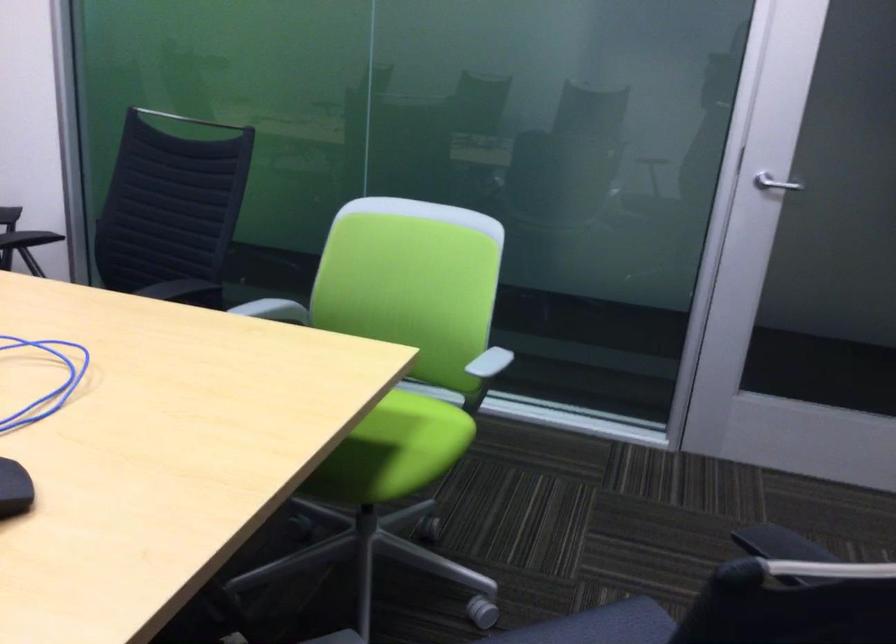
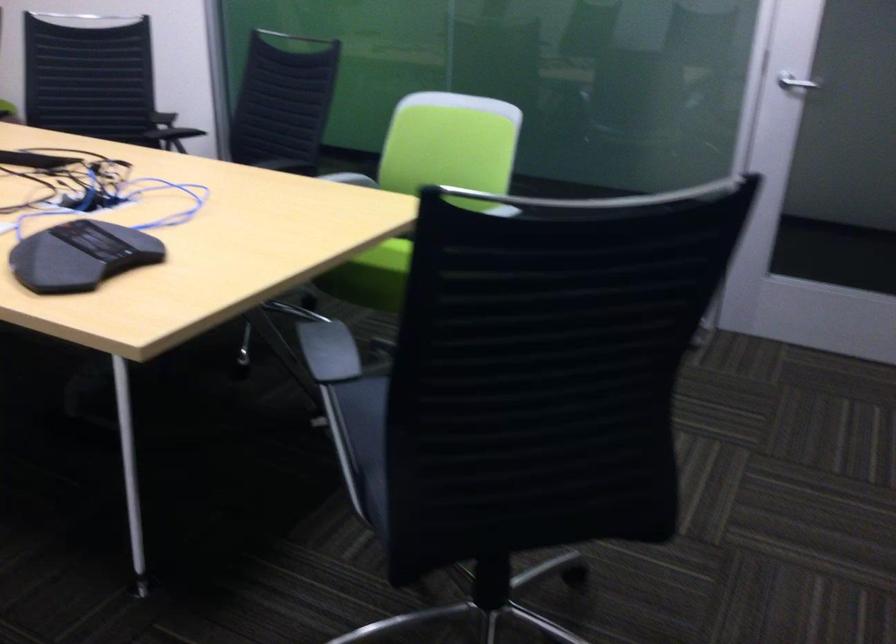
Which direction would the cameraman need to move to produce the second image?

The cameraman walked toward right, backward.